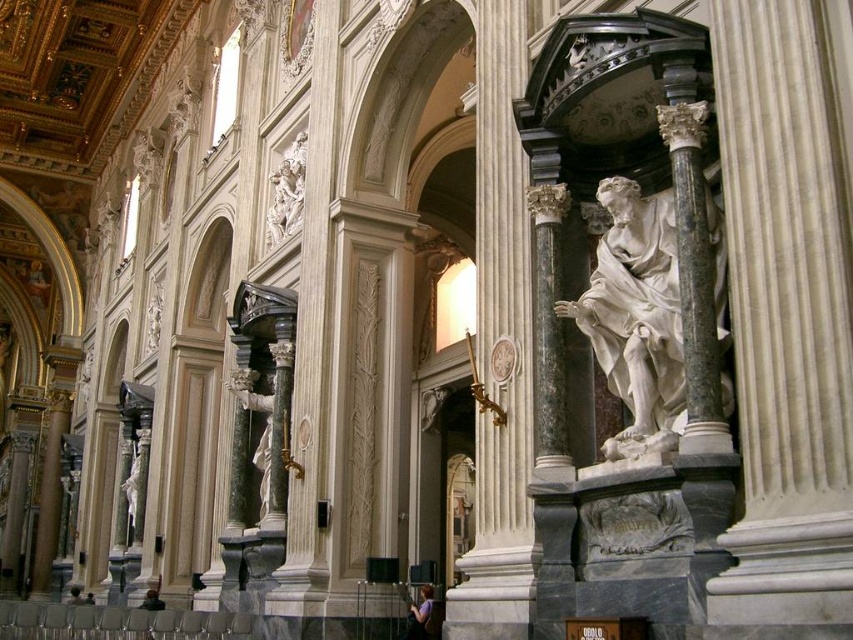
You are standing at point (717, 268) in the church. The statue is 118.24 feet away from you. Can you see the statue clearly from your current position?

The statue is 118.24 feet away from you, so yes, you can see it clearly from your current position at point (717, 268).

You are an art restorer tasked with moving a 2.5 meter wide protective cover to cover the white marble statue at center and the white marble statue at upper left. Can the cover fit over both statues if placed between them?

The white marble statue at center might be wider than white marble statue at upper left, so the 2.5 meter wide protective cover may not fit properly if placed between them. The restorer should verify the exact widths of both statues to ensure the cover accommodates the wider one.